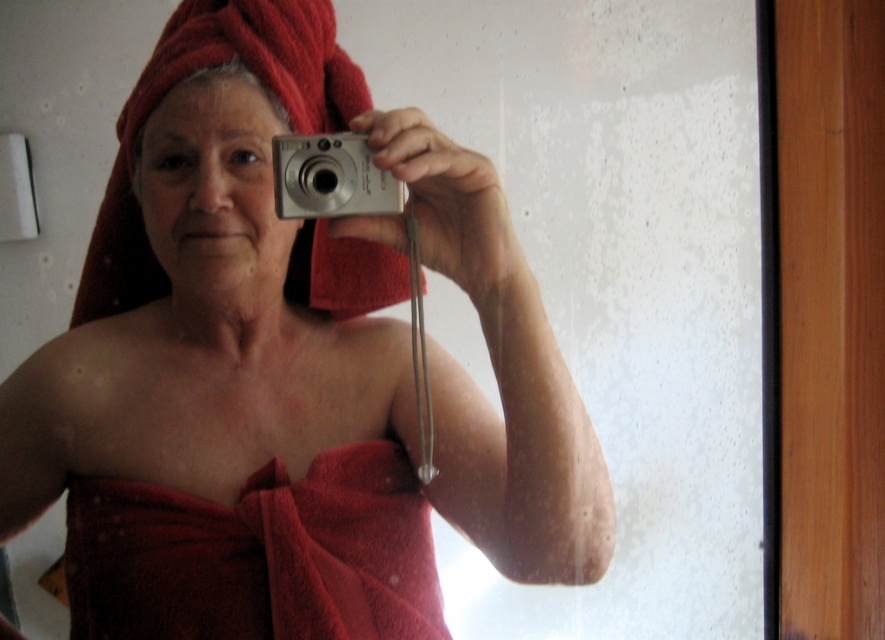
Question: Which of the following is the farthest from the observer?

Choices:
 (A) (320, 170)
 (B) (68, 609)

Answer: (B)

Question: Which of the following is the closest to the observer?

Choices:
 (A) (348, 492)
 (B) (363, 164)

Answer: (B)

Question: Among these points, which one is farthest from the camera?

Choices:
 (A) (127, 634)
 (B) (506, 378)

Answer: (A)

Question: Considering the relative positions of matte red towel at center and red towel at center in the image provided, where is matte red towel at center located with respect to red towel at center?

Choices:
 (A) above
 (B) below

Answer: (A)

Question: Can you confirm if matte red towel at center is positioned to the right of red towel at center?

Choices:
 (A) no
 (B) yes

Answer: (B)

Question: Observing the image, what is the correct spatial positioning of matte red towel at center in reference to red towel at center?

Choices:
 (A) left
 (B) right

Answer: (B)